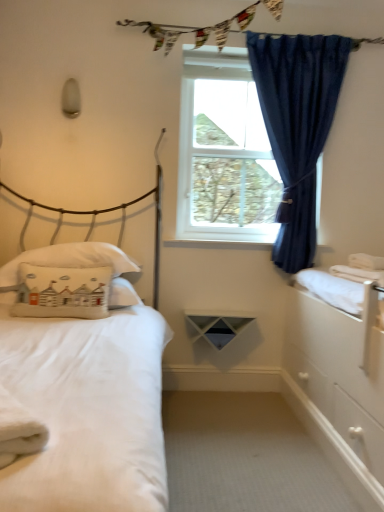
Question: Is textured fabric clothesline at upper center to the left of white matte bed at left from the viewer's perspective?

Choices:
 (A) no
 (B) yes

Answer: (A)

Question: Can you confirm if textured fabric clothesline at upper center is shorter than white matte bed at left?

Choices:
 (A) yes
 (B) no

Answer: (A)

Question: Can you confirm if textured fabric clothesline at upper center is taller than white matte bed at left?

Choices:
 (A) yes
 (B) no

Answer: (B)

Question: Does textured fabric clothesline at upper center have a smaller size compared to white matte bed at left?

Choices:
 (A) no
 (B) yes

Answer: (B)

Question: From a real-world perspective, is textured fabric clothesline at upper center on white matte bed at left?

Choices:
 (A) yes
 (B) no

Answer: (A)

Question: Is textured fabric clothesline at upper center bigger or smaller than blue velvet curtain at upper right?

Choices:
 (A) big
 (B) small

Answer: (B)

Question: From the image's perspective, is textured fabric clothesline at upper center positioned above or below blue velvet curtain at upper right?

Choices:
 (A) below
 (B) above

Answer: (B)

Question: Is textured fabric clothesline at upper center in front of or behind blue velvet curtain at upper right in the image?

Choices:
 (A) behind
 (B) front

Answer: (A)

Question: From a real-world perspective, is textured fabric clothesline at upper center positioned above or below blue velvet curtain at upper right?

Choices:
 (A) below
 (B) above

Answer: (B)

Question: Choose the correct answer: Is white cotton pillow at left, placed as the second pillow when sorted from back to front, inside blue velvet curtain at upper right or outside it?

Choices:
 (A) inside
 (B) outside

Answer: (B)

Question: Is white cotton pillow at left, acting as the first pillow starting from the front, taller or shorter than blue velvet curtain at upper right?

Choices:
 (A) tall
 (B) short

Answer: (B)

Question: Considering the relative positions of white cotton pillow at left, placed as the second pillow when sorted from back to front, and blue velvet curtain at upper right in the image provided, is white cotton pillow at left, placed as the second pillow when sorted from back to front, to the left or to the right of blue velvet curtain at upper right?

Choices:
 (A) right
 (B) left

Answer: (B)

Question: Considering the positions of white cotton pillow at left, acting as the first pillow starting from the front, and blue velvet curtain at upper right in the image, is white cotton pillow at left, acting as the first pillow starting from the front, wider or thinner than blue velvet curtain at upper right?

Choices:
 (A) wide
 (B) thin

Answer: (B)

Question: Would you say white cotton pillow at left, which is counted as the first pillow, starting from the back, is inside or outside white matte bed at left?

Choices:
 (A) inside
 (B) outside

Answer: (A)

Question: From a real-world perspective, is white cotton pillow at left, marked as the 2th pillow in a front-to-back arrangement, above or below white matte bed at left?

Choices:
 (A) above
 (B) below

Answer: (B)